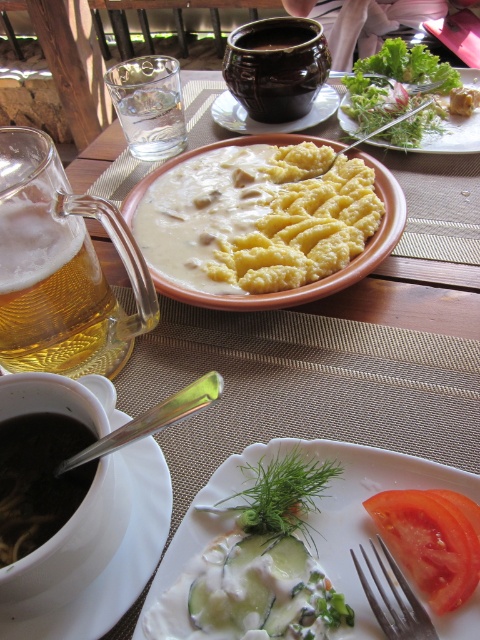
You are a server at the outdoor restaurant and need to place a small dessert plate between the silver metallic fork at lower right and the matte ceramic bowl at center. Which object should the dessert plate be closer to to ensure it fits properly?

The dessert plate should be placed closer to the silver metallic fork at lower right because it has a smaller size compared to the matte ceramic bowl at center, allowing for better spacing.

You are a server at an outdoor restaurant. You need to determine which dish or drink is larger in size between the white creamy cucumber at lower center and the foamy golden beer at left. Which one is bigger?

The white creamy cucumber at lower center is bigger than the foamy golden beer at left according to the description provided.

You are a diner at the outdoor restaurant and want to pick up the matte ceramic bowl at center. Which object, the silver metallic fork at lower right or another utensil, is directly beneath it to help stabilize the bowl?

The silver metallic fork at lower right is positioned under the matte ceramic bowl at center, so it is directly beneath the bowl to help stabilize it.